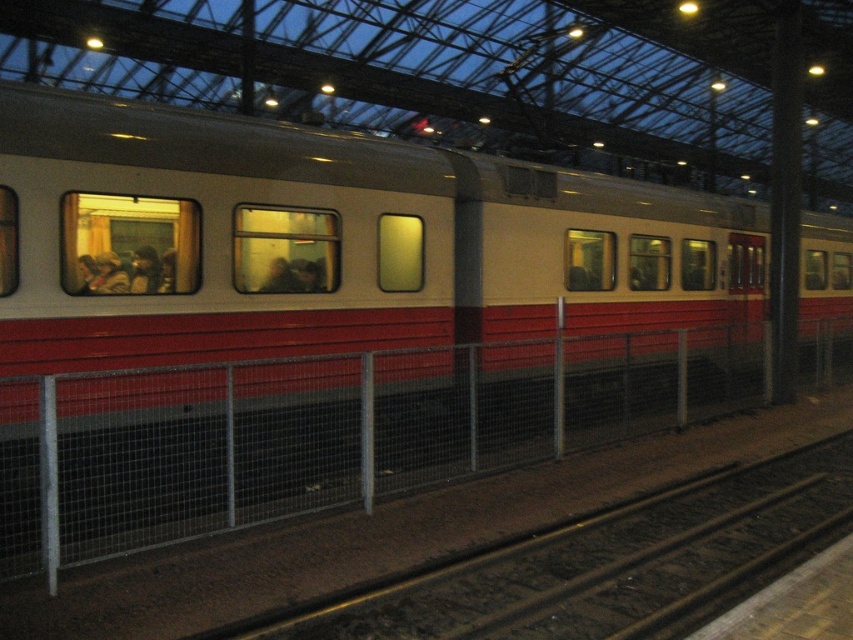
You are standing on the platform at the train station and notice two points marked on the fence in front of you. The first point is labeled as point (335, 396) and the second is point (144, 269). Which point is closer to your eyes?

Point (144, 269) is closer to your eyes because it is less further to the camera than point (335, 396).